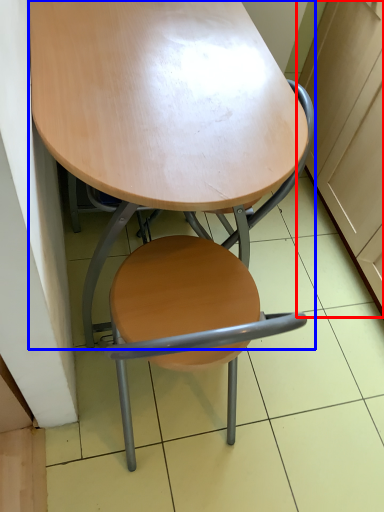
Question: Which of the following is the farthest to the observer, cabinetry (highlighted by a red box) or table (highlighted by a blue box)?

Choices:
 (A) cabinetry
 (B) table

Answer: (A)